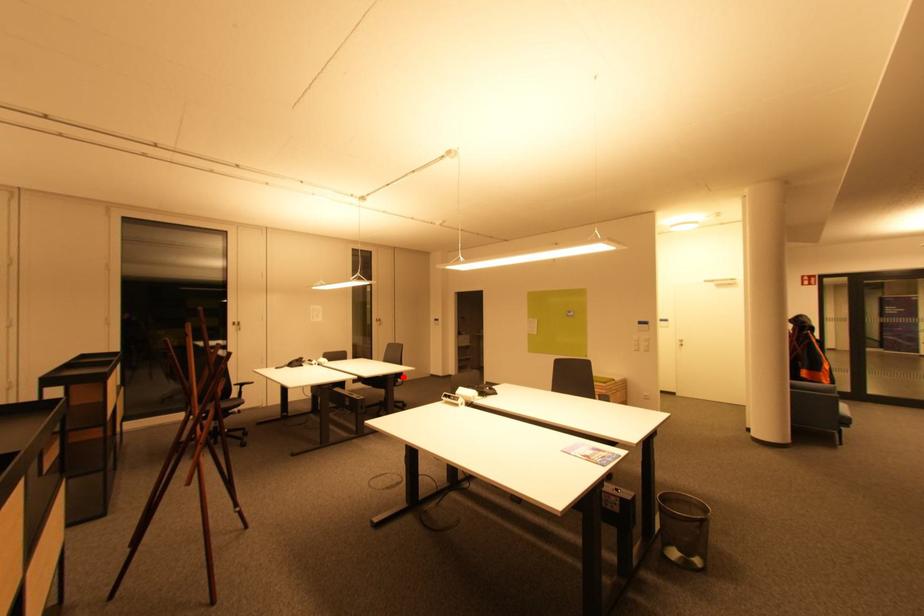
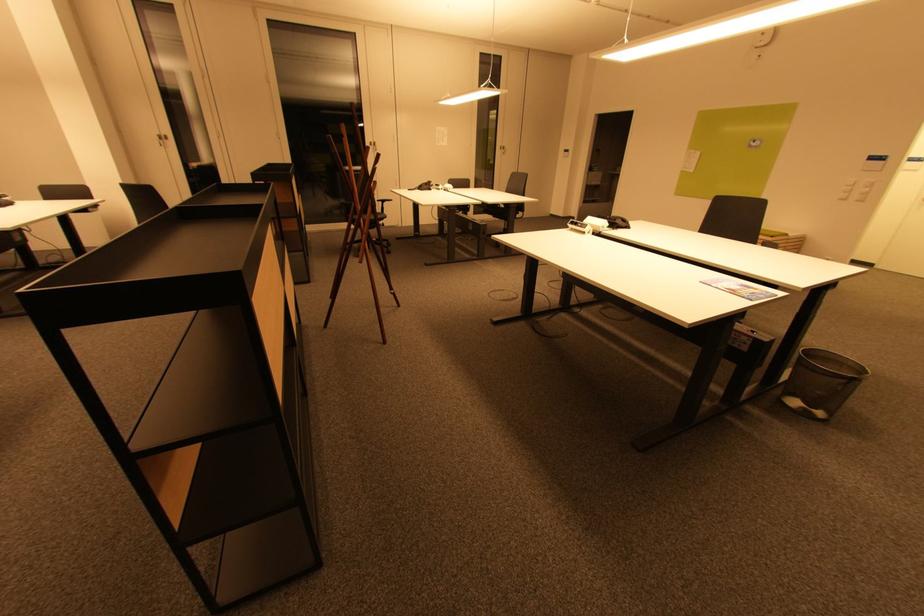
Question: A red point is marked in image1. In image2, is the corresponding 3D point closer to the camera or farther? Reply with the corresponding letter.

Choices:
 (A) The corresponding 3D point is closer.
 (B) The corresponding 3D point is farther.

Answer: (A)